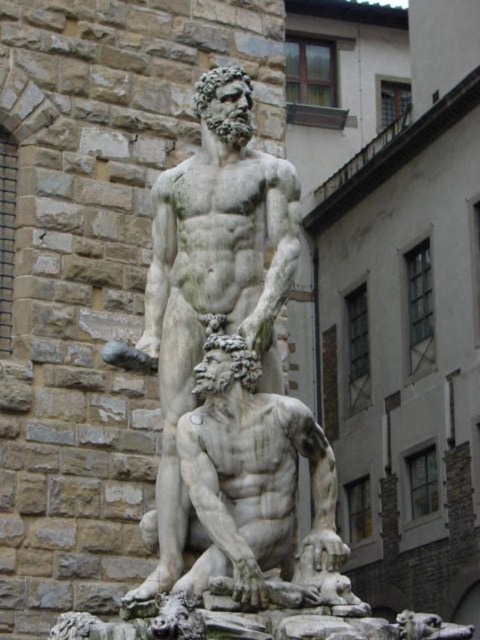
You are an art conservator assessing the sculpture. You notice that the white marble statue at center and the white marble statue at lower center have different sizes. Which one is larger?

The white marble statue at center is bigger than the white marble statue at lower center.

You are an art conservator examining the classical sculpture. You notice a specific point at coordinates (213, 276). What does this point likely represent on the sculpture?

The point at coordinates (213, 276) corresponds to the white marble statue at center.